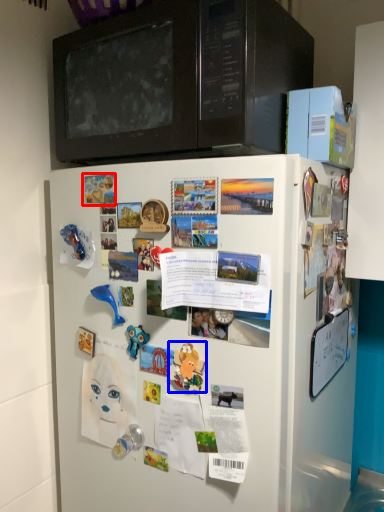
Question: Which object appears farthest to the camera in this image, poster (highlighted by a red box) or toy (highlighted by a blue box)?

Choices:
 (A) poster
 (B) toy

Answer: (A)